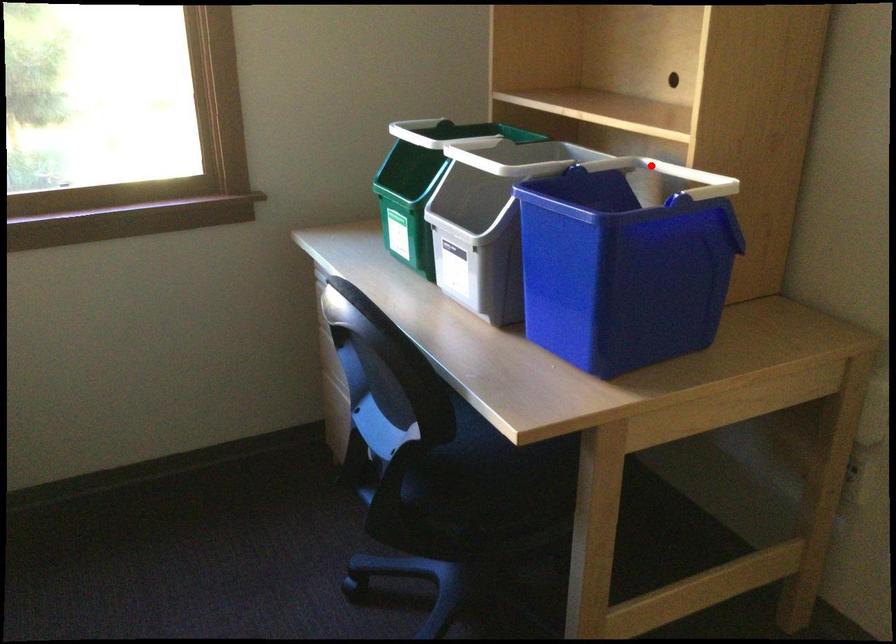
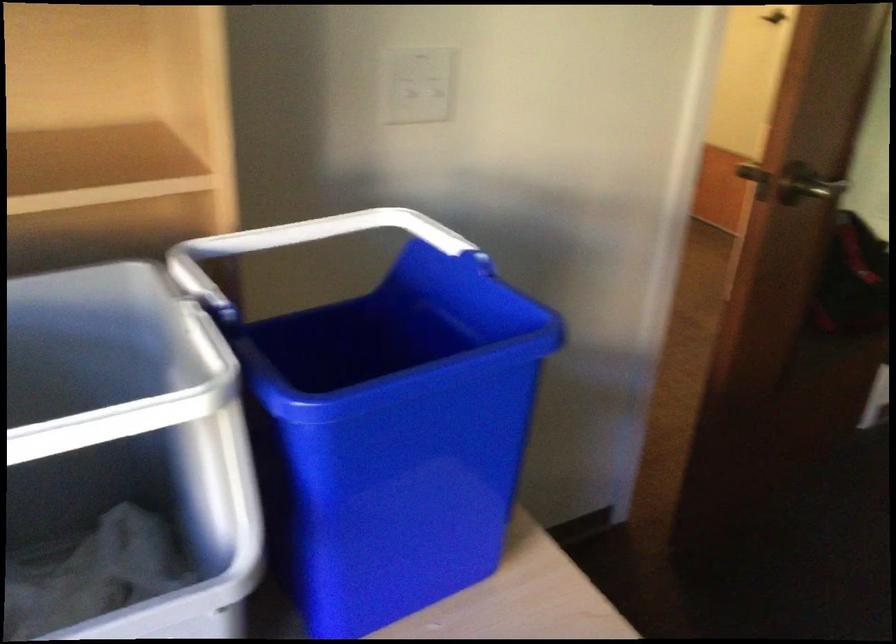
Find the pixel in the second image that matches the highlighted location in the first image.

(213, 257)